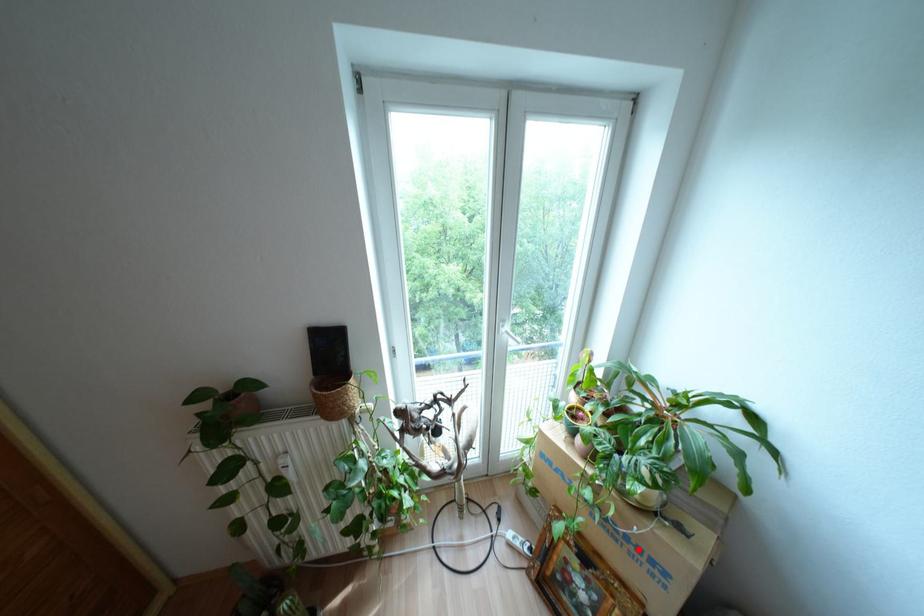
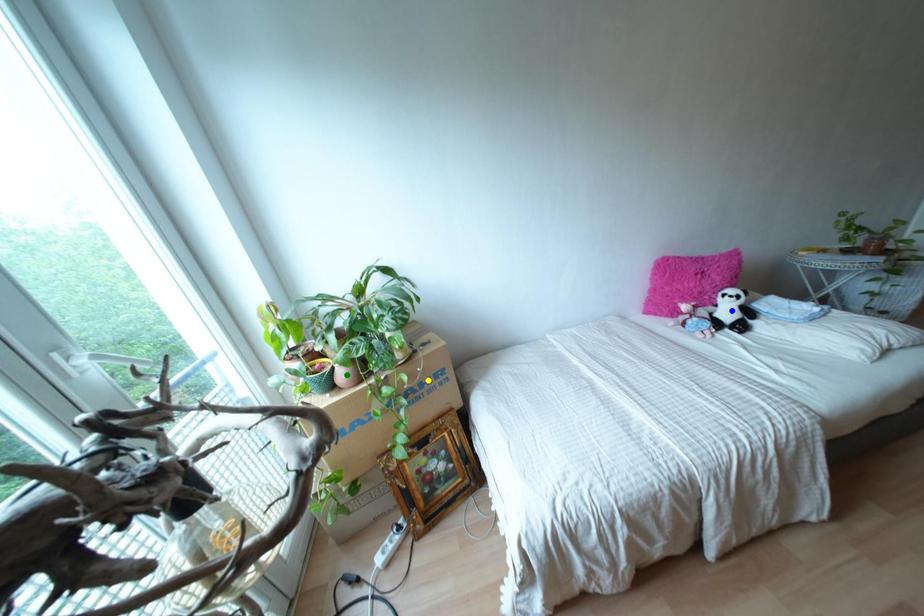
Question: I am providing you with two images of the same scene from different viewpoints. A red point is marked on the first image. You are given multiple points on the second image. Which spot in image 2 lines up with the point in image 1?

Choices:
 (A) yellow point
 (B) blue point
 (C) green point

Answer: (A)